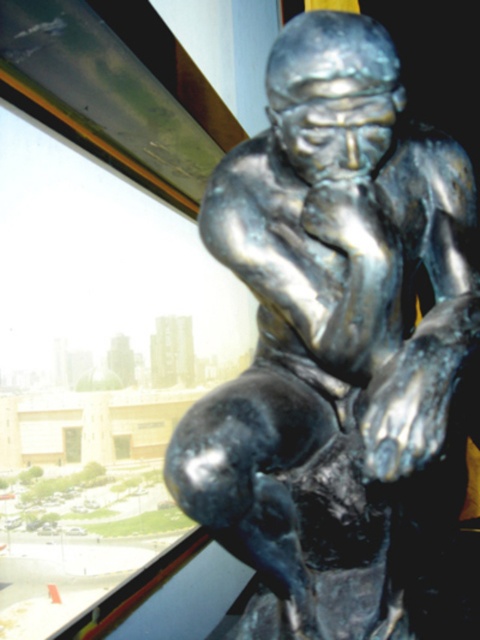
Question: Which point appears closest to the camera in this image?

Choices:
 (A) (302, 410)
 (B) (72, 433)
 (C) (122, 458)

Answer: (A)

Question: Does transparent glass window at lower left appear over transparent glass window at center?

Choices:
 (A) no
 (B) yes

Answer: (B)

Question: Among these objects, which one is nearest to the camera?

Choices:
 (A) transparent glass window at lower left
 (B) transparent glass window at center
 (C) bronze statue at center

Answer: (C)

Question: Is bronze statue at center smaller than transparent glass window at lower left?

Choices:
 (A) yes
 (B) no

Answer: (A)

Question: Can you confirm if bronze statue at center is wider than transparent glass window at lower left?

Choices:
 (A) yes
 (B) no

Answer: (B)

Question: Estimate the real-world distances between objects in this image. Which object is farther from the transparent glass window at center?

Choices:
 (A) bronze statue at center
 (B) transparent glass window at lower left

Answer: (A)